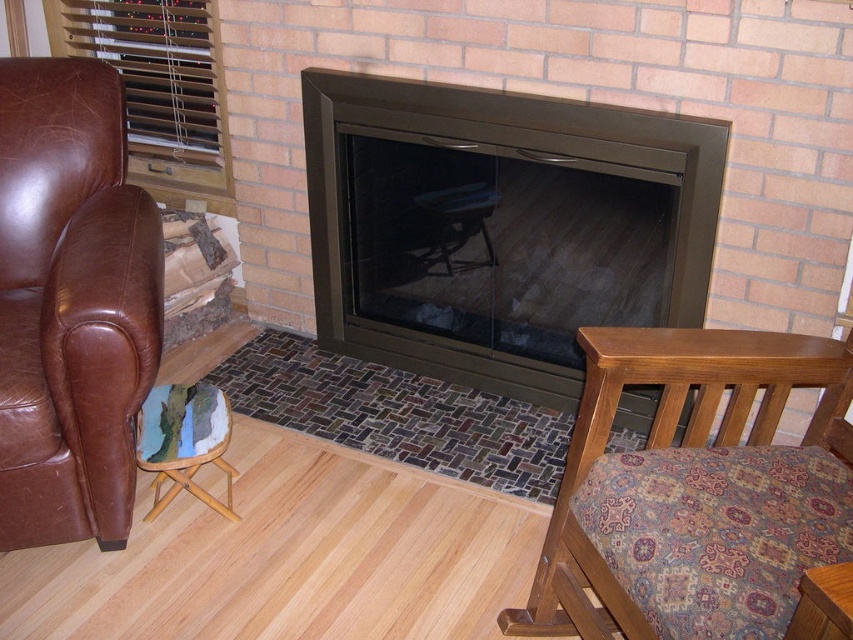
Question: Which object appears closest to the camera in this image?

Choices:
 (A) brown leather armchair at left
 (B) paisley fabric chair at lower right

Answer: (B)

Question: Is brown leather armchair at left closer to camera compared to wooden stool at lower left?

Choices:
 (A) yes
 (B) no

Answer: (A)

Question: Which object appears farthest from the camera in this image?

Choices:
 (A) matte black fireplace at center
 (B) light brown wood chair at lower right
 (C) wooden stool at lower left
 (D) brown leather armchair at left

Answer: (A)

Question: Among these points, which one is nearest to the camera?

Choices:
 (A) (149, 468)
 (B) (706, 342)
 (C) (49, 262)
 (D) (404, 316)

Answer: (B)

Question: Does paisley fabric chair at lower right have a lesser width compared to light brown wood chair at lower right?

Choices:
 (A) yes
 (B) no

Answer: (B)

Question: Can you confirm if matte black fireplace at center is thinner than wooden stool at lower left?

Choices:
 (A) yes
 (B) no

Answer: (B)